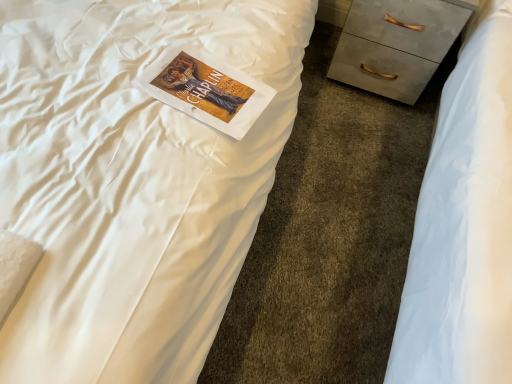
What is the approximate width of matte gray chest of drawers at right?

It is 17.32 inches.

I want to click on matte gray chest of drawers at right, so click(x=396, y=44).

What do you see at coordinates (396, 44) in the screenshot?
I see `matte gray chest of drawers at right` at bounding box center [396, 44].

In order to face matte white paperback book at center, should I rotate leftwards or rightwards?

Turn left approximately 5.785 degrees to face it.

In order to click on matte white paperback book at center in this screenshot , I will do `click(206, 89)`.

What do you see at coordinates (206, 89) in the screenshot? The height and width of the screenshot is (384, 512). I see `matte white paperback book at center` at bounding box center [206, 89].

Find the location of `matte gray chest of drawers at right`. matte gray chest of drawers at right is located at coordinates (396, 44).

Visually, is matte white paperback book at center positioned to the left or to the right of matte gray chest of drawers at right?

matte white paperback book at center is to the left of matte gray chest of drawers at right.

Relative to matte gray chest of drawers at right, is matte white paperback book at center in front or behind?

Clearly, matte white paperback book at center is in front of matte gray chest of drawers at right.

Which is in front, point (223, 99) or point (453, 15)?

The point (223, 99) is more forward.

From the image's perspective, between matte white paperback book at center and matte gray chest of drawers at right, who is located below?

matte white paperback book at center.

From a real-world perspective, is matte white paperback book at center physically above matte gray chest of drawers at right?

Yes, from a real-world perspective, matte white paperback book at center is above matte gray chest of drawers at right.

Which object is thinner, matte white paperback book at center or matte gray chest of drawers at right?

matte white paperback book at center.

Is matte white paperback book at center taller or shorter than matte gray chest of drawers at right?

matte white paperback book at center is shorter than matte gray chest of drawers at right.

Considering the relative sizes of matte white paperback book at center and matte gray chest of drawers at right in the image provided, is matte white paperback book at center bigger than matte gray chest of drawers at right?

No, matte white paperback book at center is not bigger than matte gray chest of drawers at right.

Is matte gray chest of drawers at right surrounded by matte white paperback book at center?

That's incorrect, matte gray chest of drawers at right is not inside matte white paperback book at center.

Is matte white paperback book at center in contact with matte gray chest of drawers at right?

matte white paperback book at center is not next to matte gray chest of drawers at right, and they're not touching.

Is matte white paperback book at center oriented towards matte gray chest of drawers at right?

No.

How different are the orientations of matte white paperback book at center and matte gray chest of drawers at right in degrees?

81.5 degrees separate the facing orientations of matte white paperback book at center and matte gray chest of drawers at right.

You are a GUI agent. You are given a task and a screenshot of the screen. Output one action in this format:
    pyautogui.click(x=<x>, y=<y>)
    Task: Click on the chest of drawers on the right of the matte white paperback book at center
    The height and width of the screenshot is (384, 512).
    Given the screenshot: What is the action you would take?
    pyautogui.click(x=396, y=44)

Considering the relative positions of matte gray chest of drawers at right and matte white paperback book at center in the image provided, is matte gray chest of drawers at right to the left or to the right of matte white paperback book at center?

From the image, it's evident that matte gray chest of drawers at right is to the right of matte white paperback book at center.

In the scene shown: Does matte gray chest of drawers at right lie in front of matte white paperback book at center?

No, matte gray chest of drawers at right is behind matte white paperback book at center.

Between point (375, 15) and point (185, 61), which one is positioned in front?

The point (185, 61) is closer.

From the image's perspective, would you say matte gray chest of drawers at right is positioned over matte white paperback book at center?

Indeed, from the image's perspective, matte gray chest of drawers at right is shown above matte white paperback book at center.

In the scene shown: From a real-world perspective, is matte gray chest of drawers at right on matte white paperback book at center?

No, from a real-world perspective, matte gray chest of drawers at right is not above matte white paperback book at center.

Considering the sizes of objects matte gray chest of drawers at right and matte white paperback book at center in the image provided, who is thinner, matte gray chest of drawers at right or matte white paperback book at center?

matte white paperback book at center.

From their relative heights in the image, would you say matte gray chest of drawers at right is taller or shorter than matte white paperback book at center?

Considering their sizes, matte gray chest of drawers at right has more height than matte white paperback book at center.

Considering the sizes of objects matte gray chest of drawers at right and matte white paperback book at center in the image provided, who is smaller, matte gray chest of drawers at right or matte white paperback book at center?

Smaller between the two is matte white paperback book at center.

Choose the correct answer: Is matte gray chest of drawers at right inside matte white paperback book at center or outside it?

matte gray chest of drawers at right cannot be found inside matte white paperback book at center.

Would you consider matte gray chest of drawers at right to be distant from matte white paperback book at center?

That's not correct — matte gray chest of drawers at right is a little close to matte white paperback book at center.

Is matte white paperback book at center at the back of matte gray chest of drawers at right?

matte gray chest of drawers at right does not have its back to matte white paperback book at center.

Can you tell me how much matte gray chest of drawers at right and matte white paperback book at center differ in facing direction?

They differ by 81.5 degrees in their facing directions.

The height and width of the screenshot is (384, 512). Identify the location of paperback book located below the matte gray chest of drawers at right (from the image's perspective). (206, 89).

The height and width of the screenshot is (384, 512). I want to click on the chest of drawers that appears below the matte white paperback book at center (from a real-world perspective), so click(x=396, y=44).

Where is `paperback book below the matte gray chest of drawers at right (from the image's perspective)`? The image size is (512, 384). paperback book below the matte gray chest of drawers at right (from the image's perspective) is located at coordinates (206, 89).